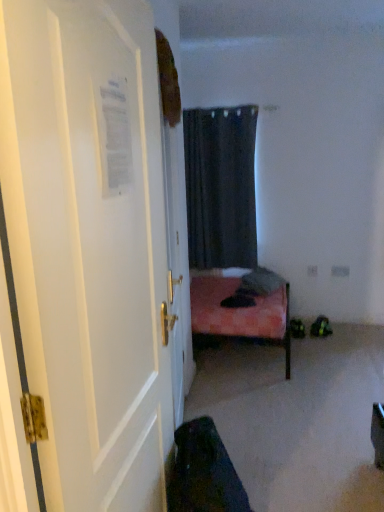
The height and width of the screenshot is (512, 384). In order to click on white glossy door at left in this screenshot , I will do [x=91, y=245].

What do you see at coordinates (91, 245) in the screenshot? I see `white glossy door at left` at bounding box center [91, 245].

Where is `dark matte curtain at center`? dark matte curtain at center is located at coordinates (221, 186).

Image resolution: width=384 pixels, height=512 pixels. What do you see at coordinates (221, 186) in the screenshot?
I see `dark matte curtain at center` at bounding box center [221, 186].

You are a GUI agent. You are given a task and a screenshot of the screen. Output one action in this format:
    pyautogui.click(x=<x>, y=<y>)
    Task: Click on the white glossy door at left
    
    Given the screenshot: What is the action you would take?
    pyautogui.click(x=91, y=245)

Based on the photo, can you confirm if dark matte curtain at center is positioned to the left of white glossy door at left?

Incorrect, dark matte curtain at center is not on the left side of white glossy door at left.

Is dark matte curtain at center positioned in front of white glossy door at left?

No, dark matte curtain at center is further to the viewer.

Is point (235, 112) closer or farther from the camera than point (89, 446)?

Point (235, 112) is farther from the camera than point (89, 446).

From the image's perspective, which object appears higher, dark matte curtain at center or white glossy door at left?

dark matte curtain at center, from the image's perspective.

From a real-world perspective, who is located higher, dark matte curtain at center or white glossy door at left?

dark matte curtain at center.

Can you confirm if dark matte curtain at center is thinner than white glossy door at left?

No, dark matte curtain at center is not thinner than white glossy door at left.

Consider the image. Is dark matte curtain at center shorter than white glossy door at left?

Indeed, dark matte curtain at center has a lesser height compared to white glossy door at left.

Consider the image. Is dark matte curtain at center bigger than white glossy door at left?

Yes.

Is dark matte curtain at center spatially inside white glossy door at left, or outside of it?

dark matte curtain at center exists outside the volume of white glossy door at left.

Is dark matte curtain at center not near white glossy door at left?

dark matte curtain at center is far away from white glossy door at left.

Is dark matte curtain at center aimed at white glossy door at left?

Yes, dark matte curtain at center is turned towards white glossy door at left.

You are a GUI agent. You are given a task and a screenshot of the screen. Output one action in this format:
    pyautogui.click(x=<x>, y=<y>)
    Task: Click on the curtain behind the white glossy door at left
    
    Given the screenshot: What is the action you would take?
    pyautogui.click(x=221, y=186)

Between white glossy door at left and dark matte curtain at center, which one appears on the right side from the viewer's perspective?

From the viewer's perspective, dark matte curtain at center appears more on the right side.

Is white glossy door at left positioned in front of dark matte curtain at center?

Yes, white glossy door at left is closer to the viewer.

Considering the positions of points (6, 200) and (199, 245), is point (6, 200) closer to camera compared to point (199, 245)?

Yes, it is in front of point (199, 245).

From the image's perspective, between white glossy door at left and dark matte curtain at center, which one is located above?

dark matte curtain at center.

Based on the photo, from a real-world perspective, between white glossy door at left and dark matte curtain at center, who is vertically higher?

dark matte curtain at center is physically above.

Can you confirm if white glossy door at left is wider than dark matte curtain at center?

Incorrect, the width of white glossy door at left does not surpass that of dark matte curtain at center.

From the picture: Between white glossy door at left and dark matte curtain at center, which one has less height?

dark matte curtain at center.

Can you confirm if white glossy door at left is smaller than dark matte curtain at center?

Correct, white glossy door at left occupies less space than dark matte curtain at center.

Could dark matte curtain at center be considered to be inside white glossy door at left?

No.

Is white glossy door at left not near dark matte curtain at center?

white glossy door at left is far away from dark matte curtain at center.

Is white glossy door at left aimed at dark matte curtain at center?

No, white glossy door at left is not facing towards dark matte curtain at center.

What's the angular difference between white glossy door at left and dark matte curtain at center's facing directions?

They differ by 87.8 degrees in their facing directions.

How far apart are white glossy door at left and dark matte curtain at center?

2.51 meters.

This screenshot has height=512, width=384. I want to click on curtain above the white glossy door at left (from the image's perspective), so click(221, 186).

You are a GUI agent. You are given a task and a screenshot of the screen. Output one action in this format:
    pyautogui.click(x=<x>, y=<y>)
    Task: Click on the door to the left of dark matte curtain at center
    The image size is (384, 512).
    Given the screenshot: What is the action you would take?
    pyautogui.click(x=91, y=245)

Where is `curtain on the right of white glossy door at left`? This screenshot has width=384, height=512. curtain on the right of white glossy door at left is located at coordinates (221, 186).